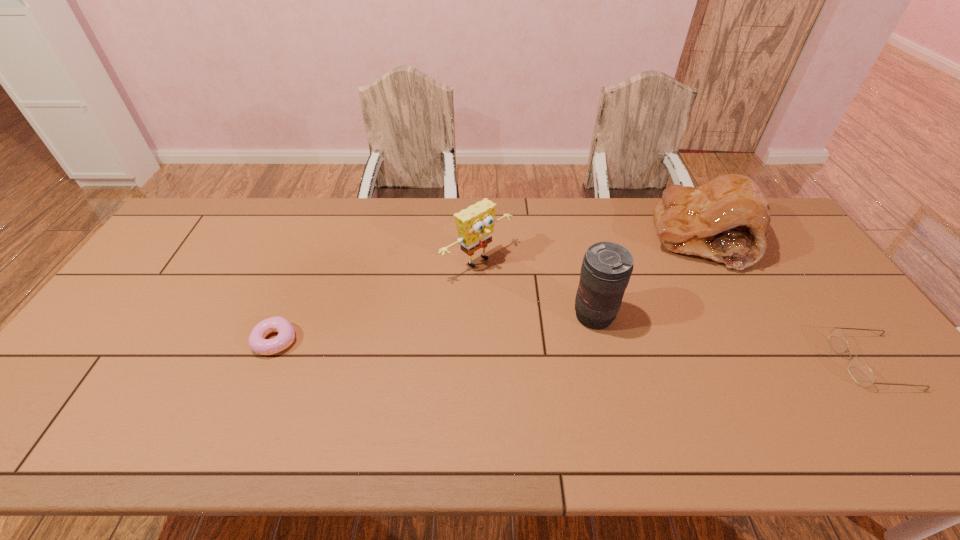
Locate an element on the screen. vacant point located 0.280m on the filling side of the bread is located at coordinates (612, 303).

Where is `vacant space located on the filling side of the bread`? The image size is (960, 540). vacant space located on the filling side of the bread is located at coordinates (610, 305).

Where is `free space located on the filling side of the bread`? Image resolution: width=960 pixels, height=540 pixels. free space located on the filling side of the bread is located at coordinates (610, 305).

The image size is (960, 540). Identify the location of free region located 0.230m on the face of the sponge. (560, 323).

I want to click on free region located 0.390m on the face of the sponge, so click(607, 360).

At what (x,y) coordinates should I click in order to perform the action: click on free space located 0.310m on the face of the sponge. Please return your answer as a coordinate pair (x, y). The height and width of the screenshot is (540, 960). Looking at the image, I should click on (582, 341).

I want to click on vacant space located 0.260m on the side of the telephoto lens where the control switches are located, so click(x=501, y=373).

At what (x,y) coordinates should I click in order to perform the action: click on free point located 0.100m on the side of the telephoto lens where the control switches are located. Please return your answer as a coordinate pair (x, y). The image size is (960, 540). Looking at the image, I should click on (550, 343).

You are a GUI agent. You are given a task and a screenshot of the screen. Output one action in this format:
    pyautogui.click(x=<x>, y=<y>)
    Task: Click on the vacant space located on the side of the telephoto lens where the control switches are located
    The width and height of the screenshot is (960, 540).
    Given the screenshot: What is the action you would take?
    pyautogui.click(x=541, y=348)

Locate an element on the screen. object present at the far edge is located at coordinates (727, 219).